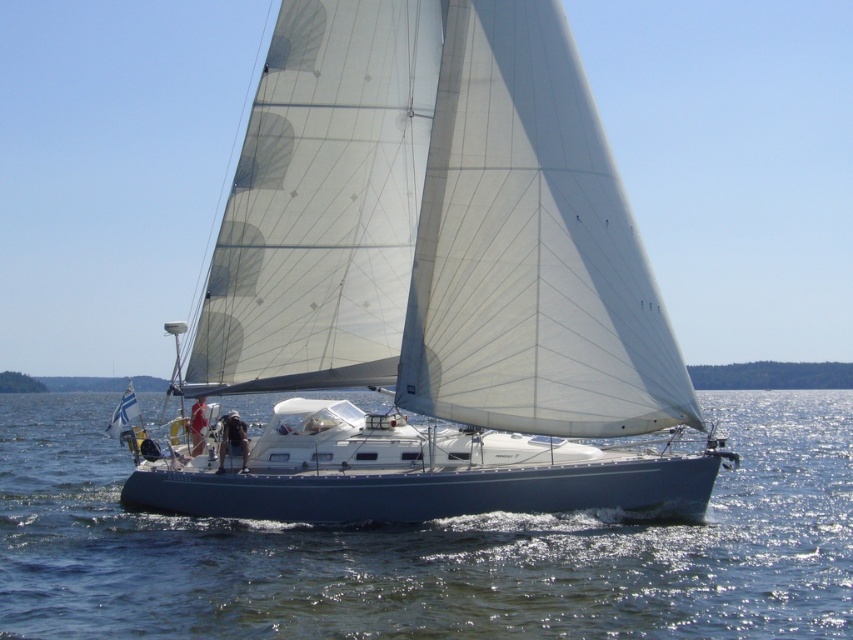
Can you confirm if white matte sailboat at center is bigger than clear blue water at center?

No.

Between white matte sailboat at center and clear blue water at center, which one has more height?

white matte sailboat at center is taller.

Image resolution: width=853 pixels, height=640 pixels. What do you see at coordinates (438, 227) in the screenshot?
I see `white matte sailboat at center` at bounding box center [438, 227].

What are the coordinates of `white matte sailboat at center` in the screenshot? It's located at (438, 227).